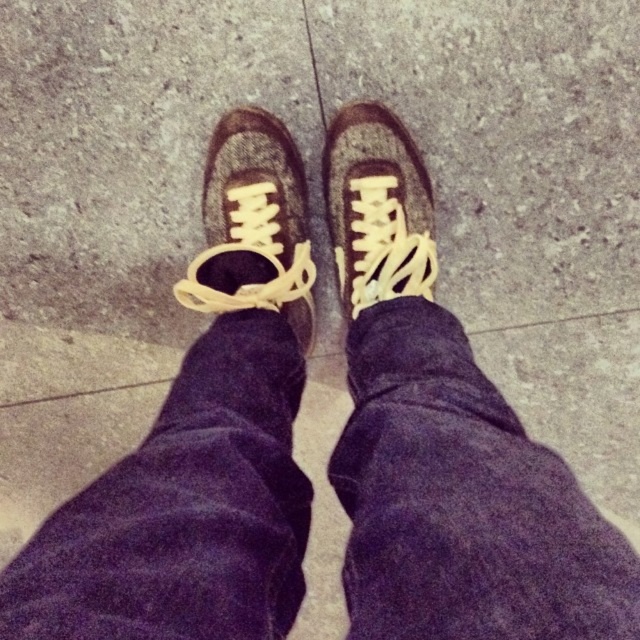
You are a delivery robot with a height of 36 inches. You need to navigate through a narrow path that is 40 inches wide. There is a point at coordinates point (216, 292) which is 39.25 inches away from you. Can you safely pass through this point without hitting your head?

The point (216, 292) is 39.25 inches away from the viewer. Since the delivery robot is 36 inches tall, it can safely pass through this point without hitting its head as the height clearance is sufficient.

You are a photographer trying to capture the texture of the shoes in the image. Since both the leather shoe at center and the matte brown shoe at center are in focus, which one would appear more detailed in the photo?

The leather shoe at center appears more detailed because it is closer to the viewer than the matte brown shoe at center, making its texture stand out more in the photo.

You are trying to decide which shoe to wear for a walk. You see the leather shoe at center and the matte brown shoe at center. Which one is bigger?

The leather shoe at center is larger in size compared to the matte brown shoe at center.